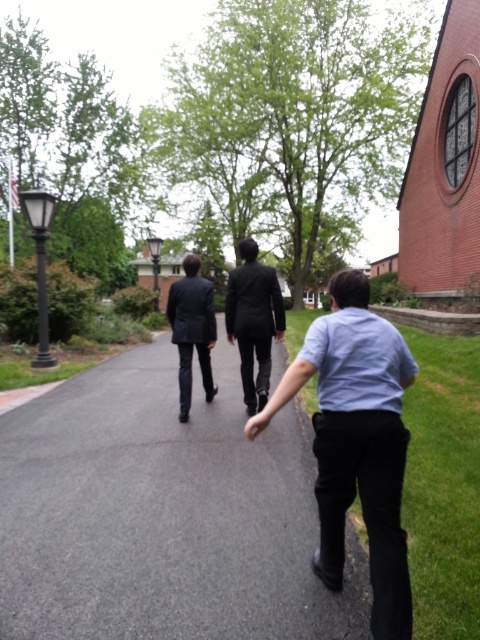
You are a pedestrian standing on the gray asphalt pavement at center. You want to step onto the grassy area next to the brick building. Is the matte black suit at center blocking your path?

The gray asphalt pavement at center is positioned under matte black suit at center, meaning the matte black suit at center is currently standing on the pavement. Since the pavement is your current position, the matte black suit at center is in your way, blocking your path to the grassy area.

You are a delivery person trying to place a package on the gray asphalt pavement at center while avoiding stepping on the matte black suit at center. Can you fit the package on the pavement without overlapping the suit?

The gray asphalt pavement at center has a smaller size compared to matte black suit at center, so placing the package might be challenging due to limited space. However, since the pavement is still present, it may be possible to position the package carefully without overlapping the suit, but there is a risk of encroaching on the suit area.